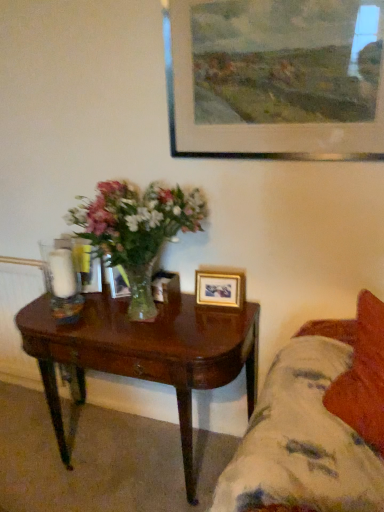
What are the coordinates of `vacant space situated above dark wood coffee table at lower left (from a real-world perspective)` in the screenshot? It's located at (141, 321).